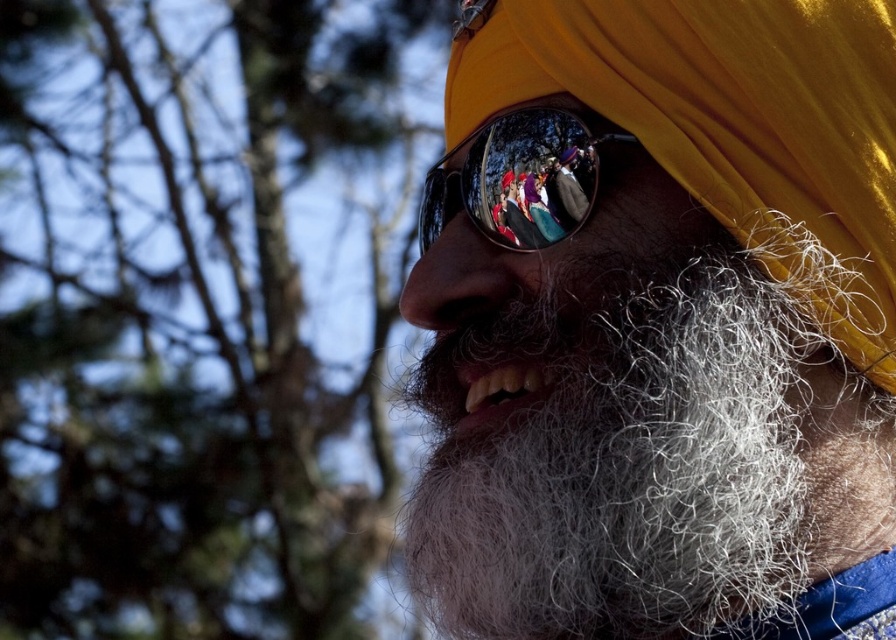
You are a photographer standing at the camera position. You want to take a photo of the person wearing the yellow turban without the green leafy tree at upper left appearing in the frame. What should you do?

The green leafy tree at upper left is 10.16 feet away from the camera. To avoid it appearing in the frame, you can move closer to the person wearing the yellow turban, reducing the distance between the camera and the subject, which would naturally exclude the tree from the shot.

You are a photographer trying to capture the best shot of the person in the image. You notice two points marked on the image at coordinates point (338, 260) and point (553, 177). Which point is closer to the camera?

Point (553, 177) is closer to the camera because the description states that point (338, 260) is behind point (553, 177).

Based on the scene description, can you determine if the yellow matte turban at center is wider than the shiny reflective sunglasses at center?

The yellow matte turban at center is wider than the shiny reflective sunglasses at center according to the description.